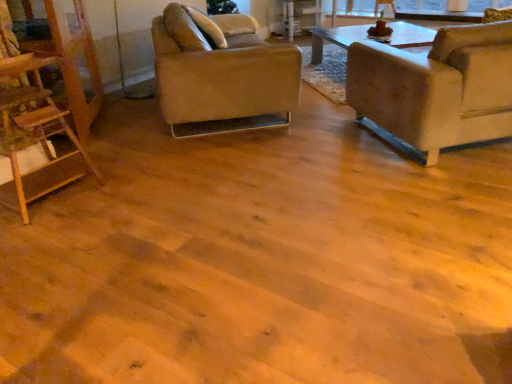
Consider the image. Measure the distance between leather-like beige chair at center-left, which is the second chair from right to left, and camera.

leather-like beige chair at center-left, which is the second chair from right to left, and camera are 9.42 feet apart.

Measure the distance between point (x=362, y=103) and camera.

Point (x=362, y=103) and camera are 3.08 meters apart from each other.

Where is `orange mesh radiator at upper left`? This screenshot has height=384, width=512. orange mesh radiator at upper left is located at coordinates (125, 58).

Is orange mesh radiator at upper left positioned far away from leather-like beige chair at center-left, which is counted as the 1th chair, starting from the left?

Yes, orange mesh radiator at upper left and leather-like beige chair at center-left, which is counted as the 1th chair, starting from the left, are located far from each other.

From the image's perspective, which is below, orange mesh radiator at upper left or leather-like beige chair at center-left, which is the second chair from right to left?

leather-like beige chair at center-left, which is the second chair from right to left.

Is point (108, 50) closer or farther from the camera than point (182, 99)?

Point (108, 50) appears to be farther away from the viewer than point (182, 99).

Which object is more forward, orange mesh radiator at upper left or leather-like beige chair at center-left, which is the second chair from right to left?

leather-like beige chair at center-left, which is the second chair from right to left, is closer to the camera.

Between leather-like beige chair at center-left, which is counted as the 1th chair, starting from the left, and suede-like beige chair at right, the first chair in the right-to-left sequence, which one has larger width?

With larger width is suede-like beige chair at right, the first chair in the right-to-left sequence.

Could you tell me if leather-like beige chair at center-left, which is the second chair from right to left, is turned towards suede-like beige chair at right, the 2th chair in the left-to-right sequence?

Yes, leather-like beige chair at center-left, which is the second chair from right to left, faces towards suede-like beige chair at right, the 2th chair in the left-to-right sequence.

Is the position of leather-like beige chair at center-left, which is counted as the 1th chair, starting from the left, more distant than that of suede-like beige chair at right, the 2th chair in the left-to-right sequence?

That is True.

Based on the photo, from the image's perspective, which one is positioned higher, leather-like beige chair at center-left, which is the second chair from right to left, or suede-like beige chair at right, the first chair in the right-to-left sequence?

leather-like beige chair at center-left, which is the second chair from right to left, is shown above in the image.

Could you tell me if orange mesh radiator at upper left is turned towards suede-like beige chair at right, the 2th chair in the left-to-right sequence?

Yes, orange mesh radiator at upper left is oriented towards suede-like beige chair at right, the 2th chair in the left-to-right sequence.

Who is shorter, orange mesh radiator at upper left or suede-like beige chair at right, the first chair in the right-to-left sequence?

Standing shorter between the two is orange mesh radiator at upper left.

Which of these two, orange mesh radiator at upper left or suede-like beige chair at right, the first chair in the right-to-left sequence, is bigger?

Bigger between the two is suede-like beige chair at right, the first chair in the right-to-left sequence.

From a real-world perspective, is orange mesh radiator at upper left located beneath suede-like beige chair at right, the first chair in the right-to-left sequence?

Yes, from a real-world perspective, orange mesh radiator at upper left is beneath suede-like beige chair at right, the first chair in the right-to-left sequence.

Is orange mesh radiator at upper left not close to wooden ladder at left?

Absolutely, orange mesh radiator at upper left is distant from wooden ladder at left.

Is orange mesh radiator at upper left spatially inside wooden ladder at left, or outside of it?

orange mesh radiator at upper left is located beyond the bounds of wooden ladder at left.

Is orange mesh radiator at upper left taller or shorter than wooden ladder at left?

Considering their sizes, orange mesh radiator at upper left has less height than wooden ladder at left.

From a real-world perspective, which is physically above, orange mesh radiator at upper left or wooden ladder at left?

wooden ladder at left is physically above.

From the image's perspective, relative to leather-like beige chair at center-left, which is counted as the 1th chair, starting from the left, is wooden ladder at left above or below?

Clearly, from the image's perspective, wooden ladder at left is below leather-like beige chair at center-left, which is counted as the 1th chair, starting from the left.

Are wooden ladder at left and leather-like beige chair at center-left, which is counted as the 1th chair, starting from the left, far apart?

Yes, wooden ladder at left is far from leather-like beige chair at center-left, which is counted as the 1th chair, starting from the left.

Does point (30, 103) come behind point (172, 89)?

No, it is not.

Which object is positioned more to the left, wooden ladder at left or leather-like beige chair at center-left, which is counted as the 1th chair, starting from the left?

wooden ladder at left.

Is suede-like beige chair at right, the first chair in the right-to-left sequence, positioned beyond the bounds of orange mesh radiator at upper left?

Yes.

Between suede-like beige chair at right, the first chair in the right-to-left sequence, and orange mesh radiator at upper left, which one has more height?

Standing taller between the two is suede-like beige chair at right, the first chair in the right-to-left sequence.

Which object is thinner, suede-like beige chair at right, the 2th chair in the left-to-right sequence, or orange mesh radiator at upper left?

orange mesh radiator at upper left.

From the picture: Which object is positioned more to the right, suede-like beige chair at right, the first chair in the right-to-left sequence, or wooden ladder at left?

suede-like beige chair at right, the first chair in the right-to-left sequence, is more to the right.

The height and width of the screenshot is (384, 512). What are the coordinates of `ladder that appears above the suede-like beige chair at right, the 2th chair in the left-to-right sequence (from a real-world perspective)` in the screenshot? It's located at (42, 98).

From a real-world perspective, is suede-like beige chair at right, the first chair in the right-to-left sequence, on wooden ladder at left?

Incorrect, from a real-world perspective, suede-like beige chair at right, the first chair in the right-to-left sequence, is lower than wooden ladder at left.

Is suede-like beige chair at right, the first chair in the right-to-left sequence, oriented towards wooden ladder at left?

No, suede-like beige chair at right, the first chair in the right-to-left sequence, does not turn towards wooden ladder at left.

Find the location of a particular element. Image resolution: width=512 pixels, height=384 pixels. radiator behind the leather-like beige chair at center-left, which is counted as the 1th chair, starting from the left is located at coordinates (125, 58).

This screenshot has width=512, height=384. Identify the location of chair above the suede-like beige chair at right, the first chair in the right-to-left sequence (from the image's perspective). (221, 73).

Which object lies further to the anchor point leather-like beige chair at center-left, which is the second chair from right to left, suede-like beige chair at right, the 2th chair in the left-to-right sequence, or orange mesh radiator at upper left?

orange mesh radiator at upper left is further to leather-like beige chair at center-left, which is the second chair from right to left.

From the image, which object appears to be farther from wooden ladder at left, orange mesh radiator at upper left or leather-like beige chair at center-left, which is counted as the 1th chair, starting from the left?

orange mesh radiator at upper left lies further to wooden ladder at left than the other object.

Estimate the real-world distances between objects in this image. Which object is closer to wooden ladder at left, leather-like beige chair at center-left, which is the second chair from right to left, or suede-like beige chair at right, the first chair in the right-to-left sequence?

leather-like beige chair at center-left, which is the second chair from right to left, is positioned closer to the anchor wooden ladder at left.

Considering their positions, is orange mesh radiator at upper left positioned further to leather-like beige chair at center-left, which is the second chair from right to left, than suede-like beige chair at right, the 2th chair in the left-to-right sequence?

The object further to leather-like beige chair at center-left, which is the second chair from right to left, is orange mesh radiator at upper left.

Looking at the image, which one is located further to orange mesh radiator at upper left, wooden ladder at left or suede-like beige chair at right, the 2th chair in the left-to-right sequence?

suede-like beige chair at right, the 2th chair in the left-to-right sequence, lies further to orange mesh radiator at upper left than the other object.

Which object lies further to the anchor point leather-like beige chair at center-left, which is counted as the 1th chair, starting from the left, wooden ladder at left or orange mesh radiator at upper left?

Based on the image, orange mesh radiator at upper left appears to be further to leather-like beige chair at center-left, which is counted as the 1th chair, starting from the left.

When comparing their distances from leather-like beige chair at center-left, which is counted as the 1th chair, starting from the left, does wooden ladder at left or suede-like beige chair at right, the first chair in the right-to-left sequence, seem closer?

suede-like beige chair at right, the first chair in the right-to-left sequence.

Based on the photo, which object lies further to the anchor point suede-like beige chair at right, the first chair in the right-to-left sequence, leather-like beige chair at center-left, which is the second chair from right to left, or orange mesh radiator at upper left?

orange mesh radiator at upper left lies further to suede-like beige chair at right, the first chair in the right-to-left sequence, than the other object.

Locate an element on the screen. The height and width of the screenshot is (384, 512). chair located between orange mesh radiator at upper left and suede-like beige chair at right, the 2th chair in the left-to-right sequence, in the left-right direction is located at coordinates (221, 73).

Where is `chair located between wooden ladder at left and suede-like beige chair at right, the 2th chair in the left-to-right sequence, in the left-right direction`? chair located between wooden ladder at left and suede-like beige chair at right, the 2th chair in the left-to-right sequence, in the left-right direction is located at coordinates click(221, 73).

Where is `ladder between orange mesh radiator at upper left and suede-like beige chair at right, the first chair in the right-to-left sequence, in the horizontal direction`? Image resolution: width=512 pixels, height=384 pixels. ladder between orange mesh radiator at upper left and suede-like beige chair at right, the first chair in the right-to-left sequence, in the horizontal direction is located at coordinates (42, 98).